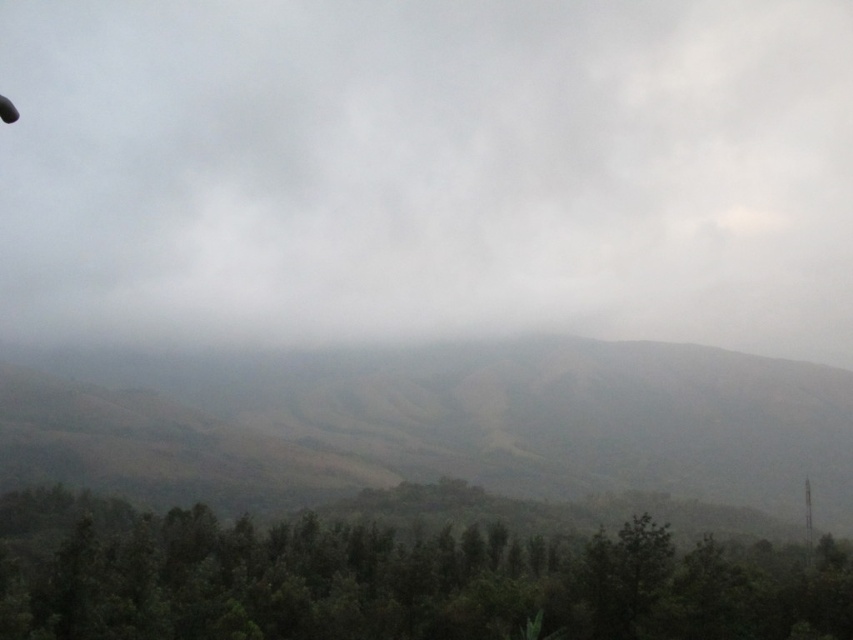
Is gray matte cloud at upper center closer to camera compared to brown matte mountain at center?

That is False.

Which is below, gray matte cloud at upper center or brown matte mountain at center?

brown matte mountain at center

Is point (743, 172) positioned before point (479, 419)?

No.

Locate an element on the screen. gray matte cloud at upper center is located at coordinates (428, 170).

Does brown matte mountain at center appear under green matte trees at lower center?

Yes, brown matte mountain at center is below green matte trees at lower center.

Which is below, brown matte mountain at center or green matte trees at lower center?

brown matte mountain at center

I want to click on brown matte mountain at center, so click(444, 428).

Is point (254, 189) positioned in front of point (416, 573)?

That is False.

Does gray matte cloud at upper center come behind green matte trees at lower center?

Yes, gray matte cloud at upper center is further from the viewer.

Is point (743, 67) farther from viewer compared to point (851, 561)?

Yes, point (743, 67) is farther from viewer.

The width and height of the screenshot is (853, 640). What are the coordinates of `gray matte cloud at upper center` in the screenshot? It's located at (428, 170).